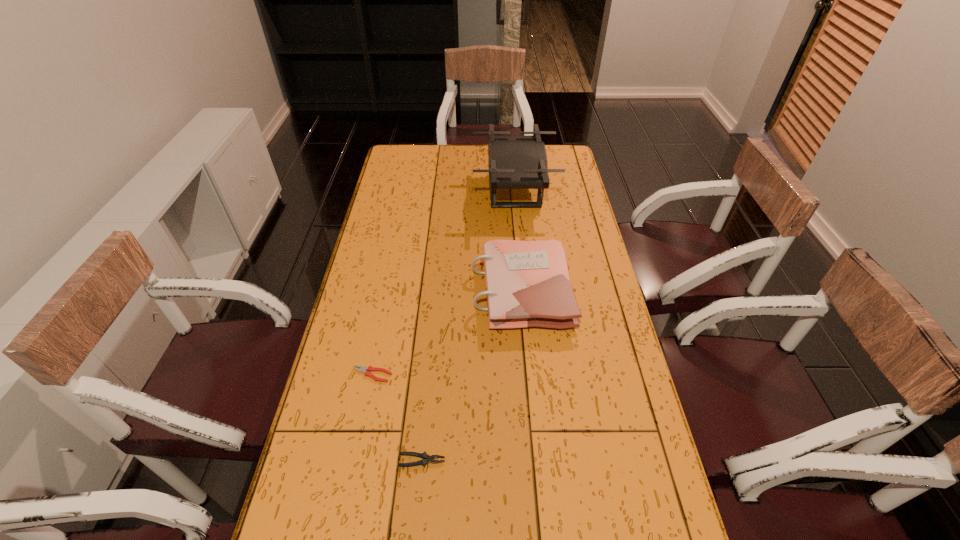
Image resolution: width=960 pixels, height=540 pixels. I want to click on vacant point at the right edge, so click(578, 201).

This screenshot has height=540, width=960. In order to click on blank area at the far left corner in this screenshot , I will do `click(398, 146)`.

Identify the location of vacant region between the third object from right to left and the farther pliers. (397, 417).

What are the coordinates of `free space between the drone and the farther pliers` in the screenshot? It's located at (444, 283).

Where is `vacant region between the second farthest object and the nearer pliers`? vacant region between the second farthest object and the nearer pliers is located at coordinates (471, 375).

Identify the location of unoccupied area between the drone and the shortest object. (444, 283).

The height and width of the screenshot is (540, 960). In order to click on vacant area between the shorter pliers and the second farthest object in this screenshot , I will do `click(446, 333)`.

Identify the location of vacant region between the shortest object and the tallest object. The image size is (960, 540). [x=444, y=283].

The height and width of the screenshot is (540, 960). I want to click on vacant area that lies between the right pliers and the third shortest object, so click(471, 375).

Locate an element on the screen. free point between the second farthest object and the leftmost object is located at coordinates [446, 333].